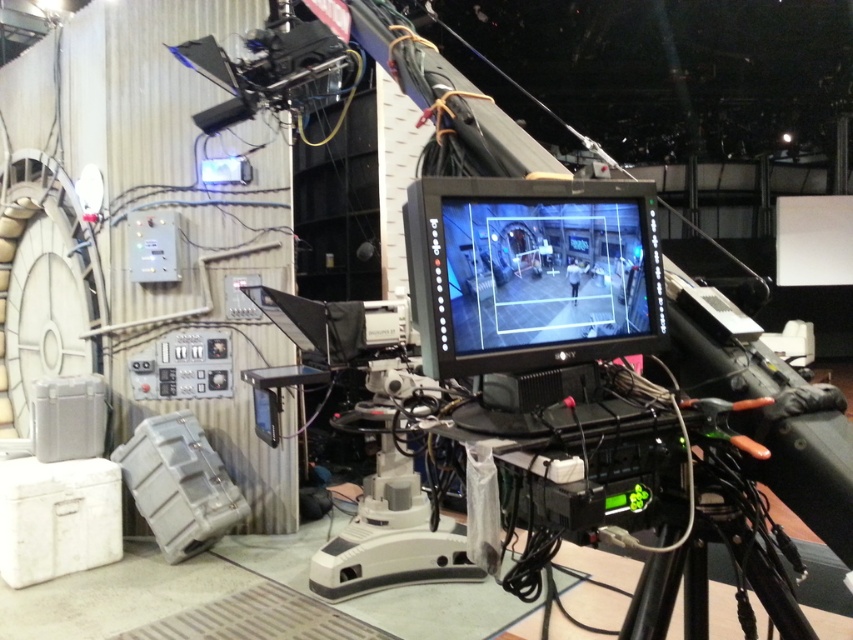
Question: Is matte black monitor at center behind black plastic tripod at lower right?

Choices:
 (A) yes
 (B) no

Answer: (A)

Question: Which point is closer to the camera taking this photo?

Choices:
 (A) (660, 625)
 (B) (492, 272)

Answer: (B)

Question: Among these objects, which one is farthest from the camera?

Choices:
 (A) black plastic tripod at lower right
 (B) matte black monitor at center

Answer: (B)

Question: Is matte black monitor at center smaller than black plastic tripod at lower right?

Choices:
 (A) no
 (B) yes

Answer: (B)

Question: Which point is closer to the camera?

Choices:
 (A) (646, 218)
 (B) (778, 611)

Answer: (B)

Question: Does matte black monitor at center have a greater width compared to black plastic tripod at lower right?

Choices:
 (A) no
 (B) yes

Answer: (B)